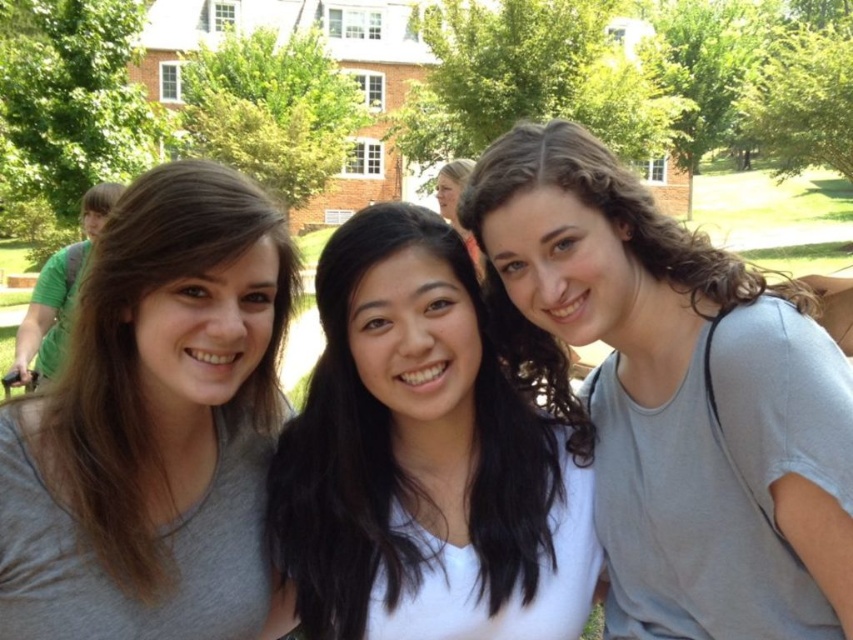
Question: Which object is positioned closest to the white matte shirt at center?

Choices:
 (A) matte gray shirt at left
 (B) matte gray shirt at center

Answer: (A)

Question: Can you confirm if matte gray shirt at center is positioned to the right of matte gray shirt at left?

Choices:
 (A) yes
 (B) no

Answer: (A)

Question: Considering the relative positions of matte gray shirt at center and white matte shirt at center in the image provided, where is matte gray shirt at center located with respect to white matte shirt at center?

Choices:
 (A) right
 (B) left

Answer: (A)

Question: Which object is closer to the camera taking this photo?

Choices:
 (A) matte gray shirt at center
 (B) matte gray shirt at left
 (C) white matte shirt at center

Answer: (B)

Question: Which of these objects is positioned farthest from the white matte shirt at center?

Choices:
 (A) matte gray shirt at left
 (B) matte gray shirt at center

Answer: (B)

Question: Is matte gray shirt at center below white matte shirt at center?

Choices:
 (A) no
 (B) yes

Answer: (A)